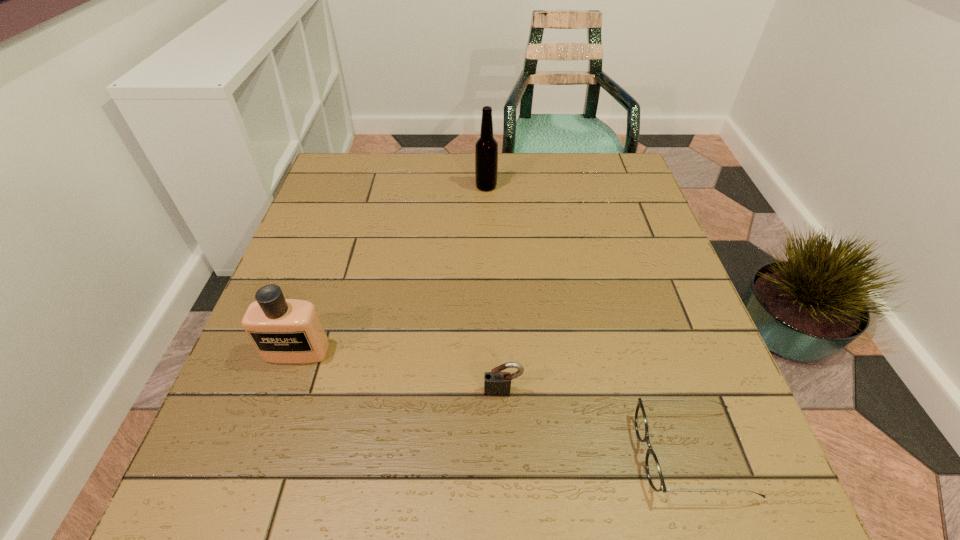
The image size is (960, 540). I want to click on free space located with the keyhole on the front of the padlock, so click(505, 438).

You are a GUI agent. You are given a task and a screenshot of the screen. Output one action in this format:
    pyautogui.click(x=<x>, y=<y>)
    Task: Click on the vacant space located through the lenses of the nearest object
    The width and height of the screenshot is (960, 540).
    Given the screenshot: What is the action you would take?
    pyautogui.click(x=477, y=454)

Identify the location of vacant area situated through the lenses of the nearest object. (452, 454).

The image size is (960, 540). Find the location of `vacant region located through the lenses of the nearest object`. vacant region located through the lenses of the nearest object is located at coordinates (562, 454).

Identify the location of object located in the far edge section of the desktop. (486, 148).

Locate an element on the screen. object positioned at the near edge is located at coordinates (653, 469).

Locate an element on the screen. The width and height of the screenshot is (960, 540). object located at the left edge is located at coordinates (289, 331).

Identify the location of object at the right edge. This screenshot has height=540, width=960. (653, 469).

Image resolution: width=960 pixels, height=540 pixels. Identify the location of object located at the near right corner. (653, 469).

Identify the location of vacant space at the far edge. (401, 171).